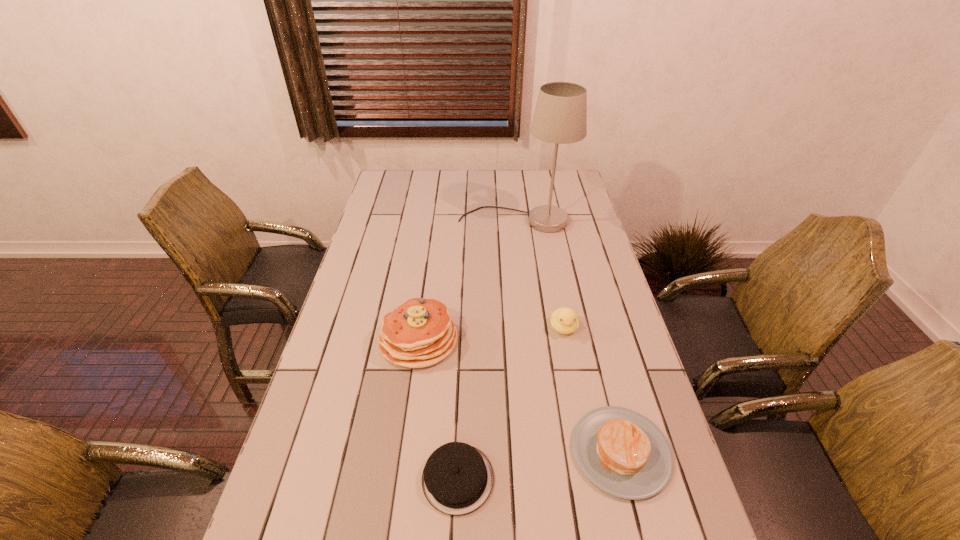
Identify which object is the third closest to the tallest pancake. Please provide its 2D coordinates. Your answer should be formatted as a tuple, i.e. [(x, y)], where the tuple contains the x and y coordinates of a point satisfying the conditions above.

[(623, 453)]

Locate an element on the screen. This screenshot has width=960, height=540. pancake that stands as the closest to the farthest object is located at coordinates (419, 333).

Locate an element on the screen. This screenshot has height=540, width=960. pancake that is the nearest to the farthest pancake is located at coordinates (457, 479).

The height and width of the screenshot is (540, 960). I want to click on free spot that satisfies the following two spatial constraints: 1. on the front side of the second shortest pancake; 2. on the left side of the second tallest object, so click(403, 451).

The image size is (960, 540). What are the coordinates of `free region that satisfies the following two spatial constraints: 1. on the front side of the fourth shortest object; 2. on the right side of the rightmost pancake` in the screenshot? It's located at coord(403,451).

Where is `vacant space that satisfies the following two spatial constraints: 1. on the front side of the farthest pancake; 2. on the right side of the second shortest object`? The width and height of the screenshot is (960, 540). vacant space that satisfies the following two spatial constraints: 1. on the front side of the farthest pancake; 2. on the right side of the second shortest object is located at coordinates (403, 451).

Locate an element on the screen. free point that satisfies the following two spatial constraints: 1. at the beak of the duckling; 2. on the right side of the rightmost pancake is located at coordinates (588, 451).

Where is `vacant space that satisfies the following two spatial constraints: 1. on the back side of the table lamp; 2. on the right side of the shortest object`? This screenshot has height=540, width=960. vacant space that satisfies the following two spatial constraints: 1. on the back side of the table lamp; 2. on the right side of the shortest object is located at coordinates (468, 221).